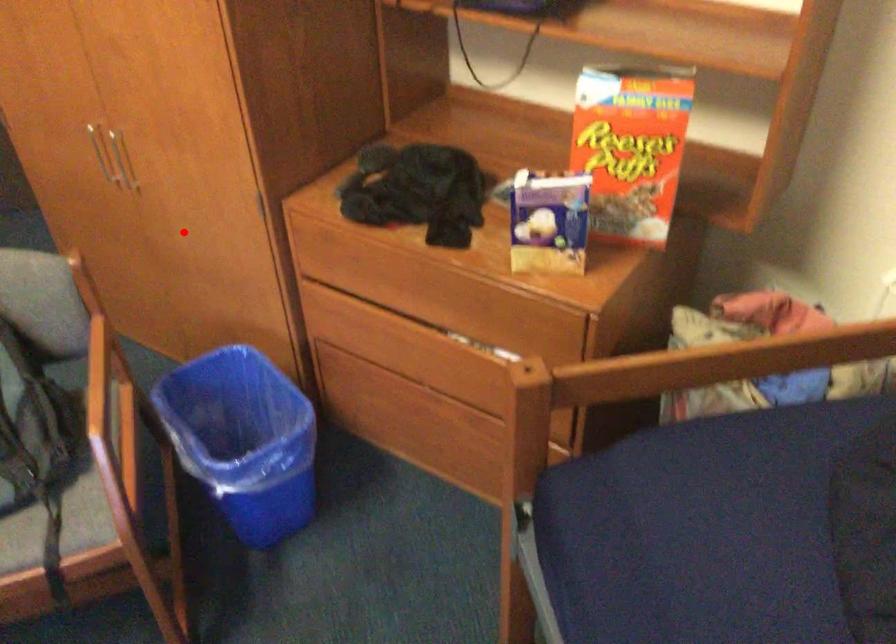
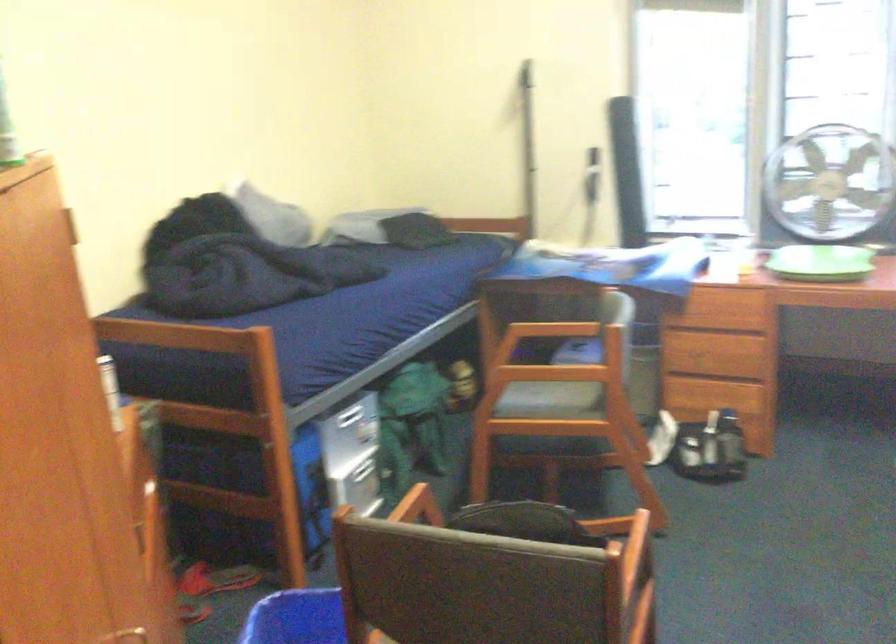
The point at the highlighted location is marked in the first image. Where is the corresponding point in the second image?

(141, 630)